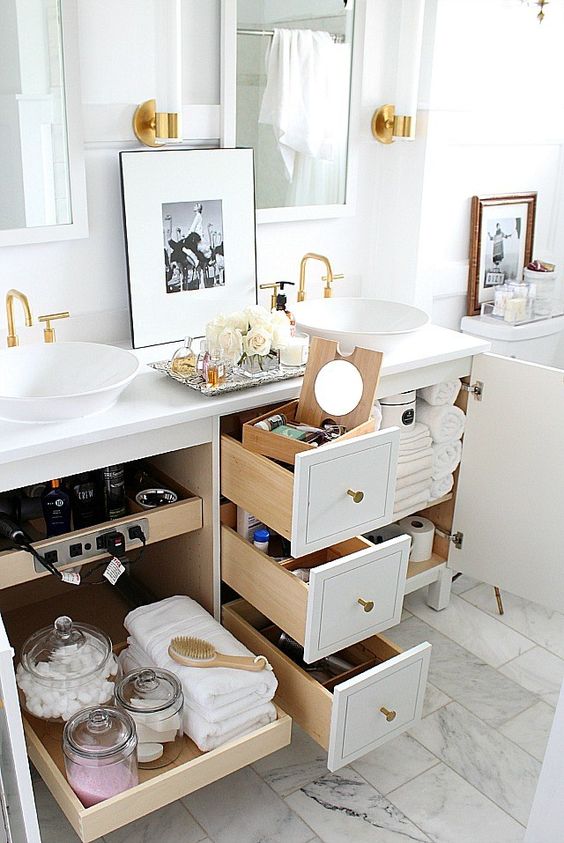
The image size is (564, 843). Identify the location of hinge. (457, 539), (472, 392).